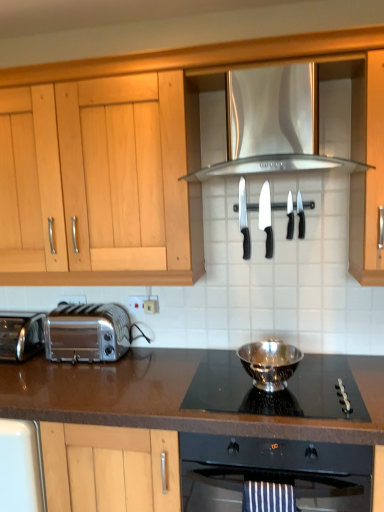
In order to click on vacant point above brown laminate countertop at center (from a real-world perspective) in this screenshot , I will do `click(133, 372)`.